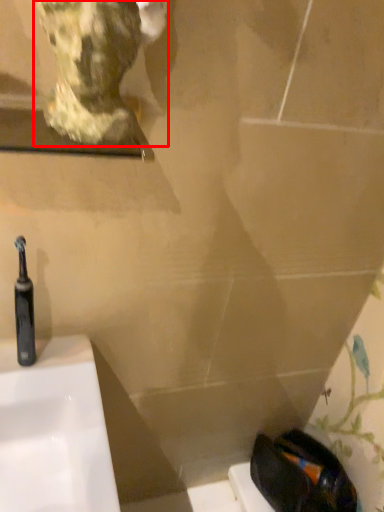
Question: Where is sculpture (annotated by the red box) located in relation to toothbrush in the image?

Choices:
 (A) left
 (B) right

Answer: (B)